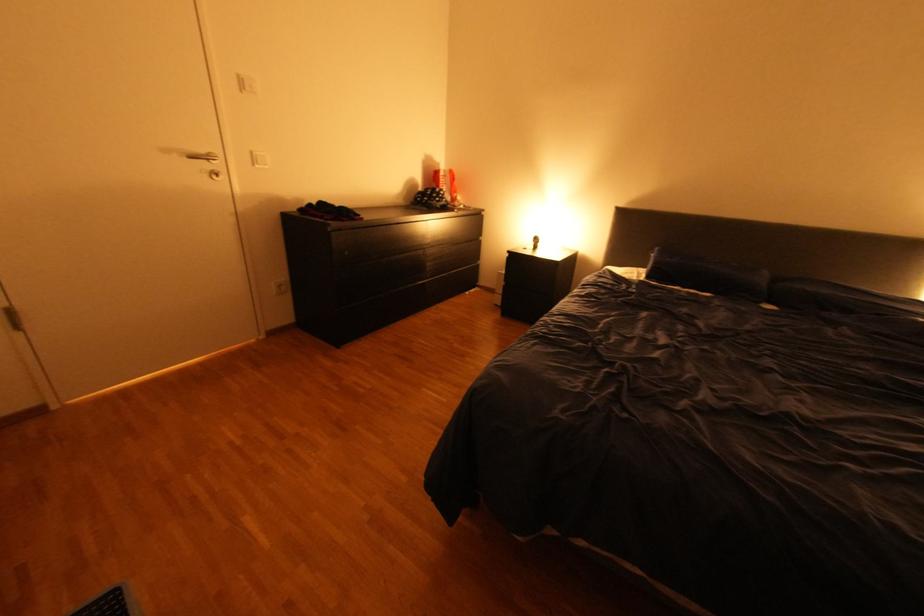
Describe the element at coordinates (202, 156) in the screenshot. I see `the silver door handle` at that location.